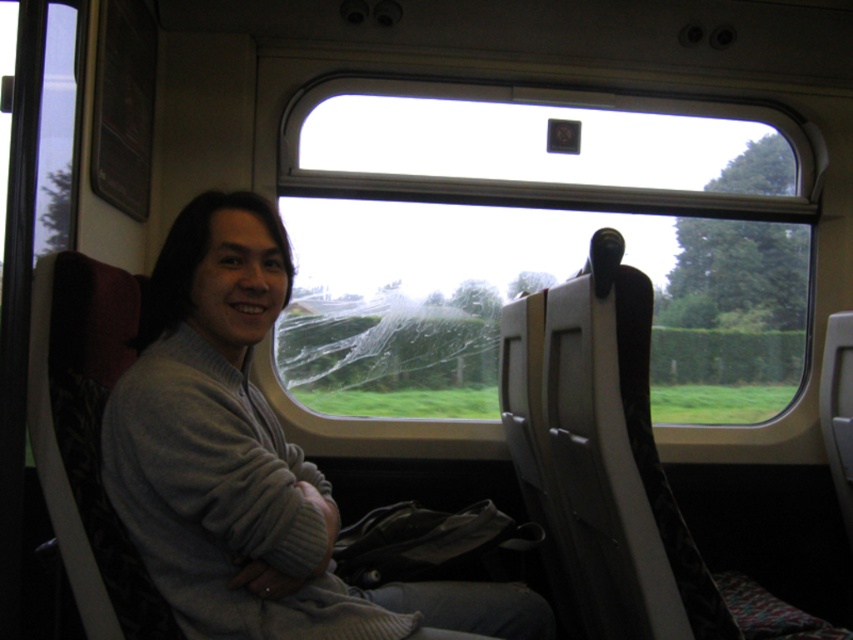
You are a passenger on a train and you want to see the view outside through the transparent glass train window at center. However, your gray knitwear at center is blocking part of the window. Can you see the entire window view without moving your current position?

The transparent glass train window at center is taller than the gray knitwear at center, so yes, you can see the entire window view without moving your position because the window extends beyond the height of the gray knitwear at center.

You are a passenger on a train and want to take a photo of the landscape outside through the transparent glass train window at center. However, your gray knitwear at center is blocking the view. Can you determine if the window is large enough to frame the entire landscape without moving your clothing?

The transparent glass train window at center is larger in size than gray knitwear at center, so you can move your gray knitwear at center aside to frame the entire landscape through the transparent glass train window at center without obstruction.

You are a passenger sitting in the train carriage and want to know which of the two points, point (665, 141) or point (486, 611), is closer to you. Can you determine this based on their positions?

Point (665, 141) is further to the viewer than point (486, 611), so the point (486, 611) is closer to you.